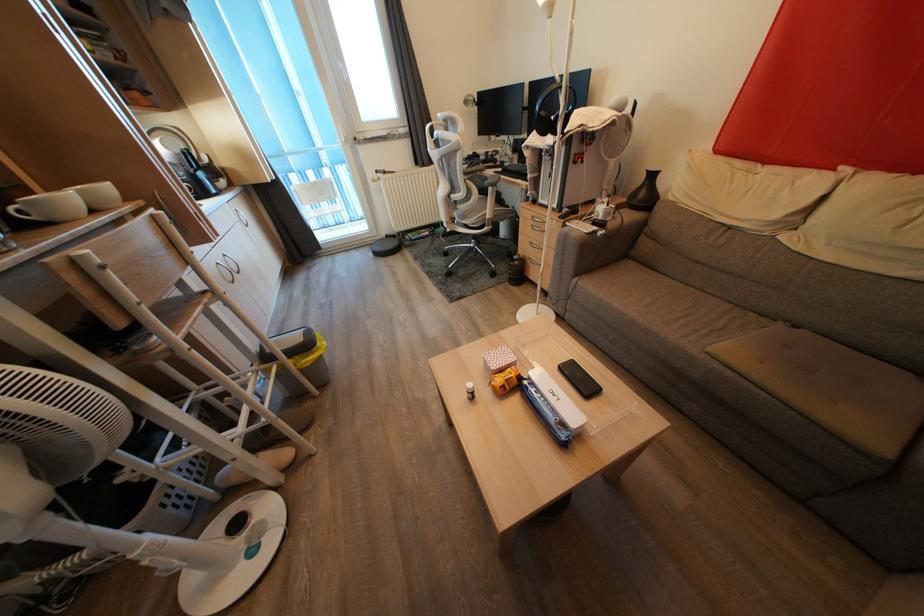
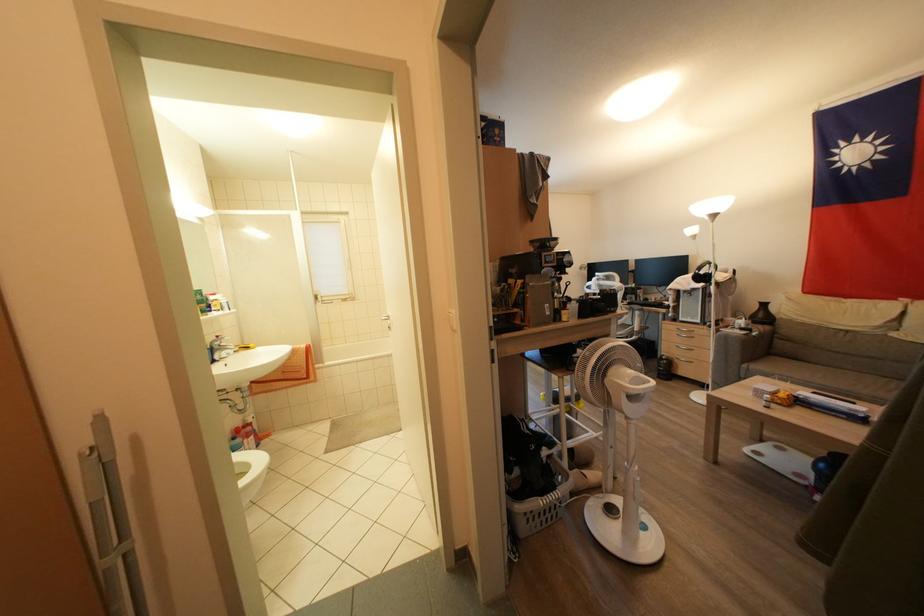
Find the pixel in the second image that matches the point at 544,205 in the first image.

(686, 323)